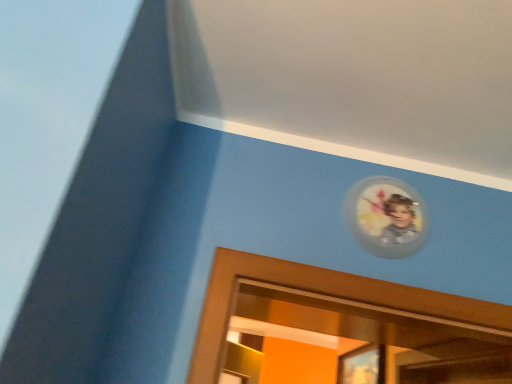
Question: Could matte wooden portrait at upper center be considered to be inside transparent plastic picture frame at upper right?

Choices:
 (A) no
 (B) yes

Answer: (A)

Question: Can you confirm if transparent plastic picture frame at upper right is wider than matte wooden portrait at upper center?

Choices:
 (A) no
 (B) yes

Answer: (A)

Question: Can we say transparent plastic picture frame at upper right lies outside matte wooden portrait at upper center?

Choices:
 (A) yes
 (B) no

Answer: (A)

Question: Is transparent plastic picture frame at upper right thinner than matte wooden portrait at upper center?

Choices:
 (A) yes
 (B) no

Answer: (A)

Question: Considering the relative sizes of transparent plastic picture frame at upper right and matte wooden portrait at upper center in the image provided, is transparent plastic picture frame at upper right taller than matte wooden portrait at upper center?

Choices:
 (A) yes
 (B) no

Answer: (A)

Question: Is transparent plastic picture frame at upper right closer to the viewer compared to matte wooden portrait at upper center?

Choices:
 (A) yes
 (B) no

Answer: (A)

Question: Are matte wooden portrait at upper center and transparent plastic picture frame at upper right beside each other?

Choices:
 (A) yes
 (B) no

Answer: (B)

Question: Considering the relative sizes of matte wooden portrait at upper center and transparent plastic picture frame at upper right in the image provided, is matte wooden portrait at upper center shorter than transparent plastic picture frame at upper right?

Choices:
 (A) no
 (B) yes

Answer: (B)

Question: Considering the relative positions of matte wooden portrait at upper center and transparent plastic picture frame at upper right in the image provided, is matte wooden portrait at upper center to the left of transparent plastic picture frame at upper right from the viewer's perspective?

Choices:
 (A) yes
 (B) no

Answer: (B)

Question: Does matte wooden portrait at upper center have a greater height compared to transparent plastic picture frame at upper right?

Choices:
 (A) yes
 (B) no

Answer: (B)

Question: Does matte wooden portrait at upper center come behind transparent plastic picture frame at upper right?

Choices:
 (A) no
 (B) yes

Answer: (B)

Question: Is matte wooden portrait at upper center closer to camera compared to transparent plastic picture frame at upper right?

Choices:
 (A) no
 (B) yes

Answer: (A)

Question: From the image's perspective, is transparent plastic picture frame at upper right positioned above or below matte wooden portrait at upper center?

Choices:
 (A) below
 (B) above

Answer: (B)